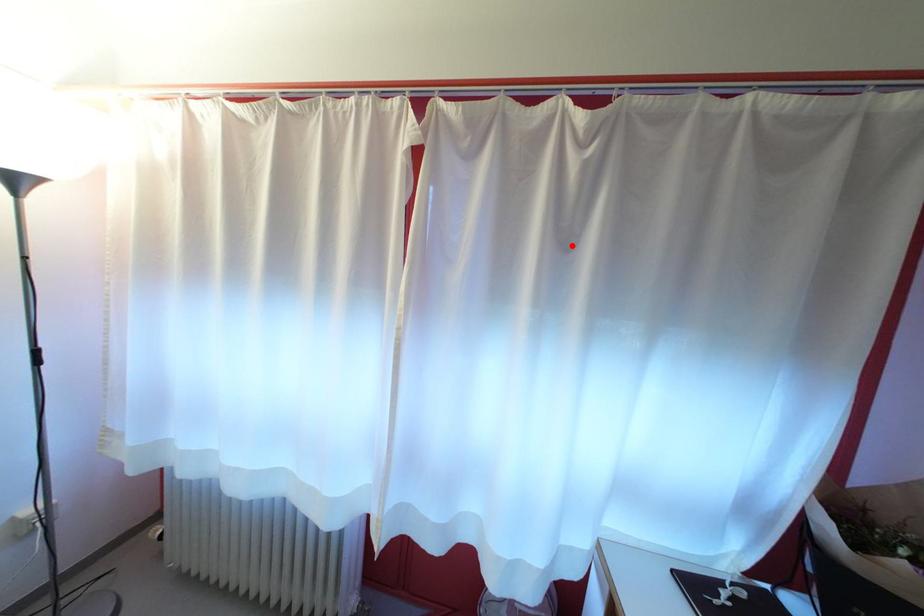
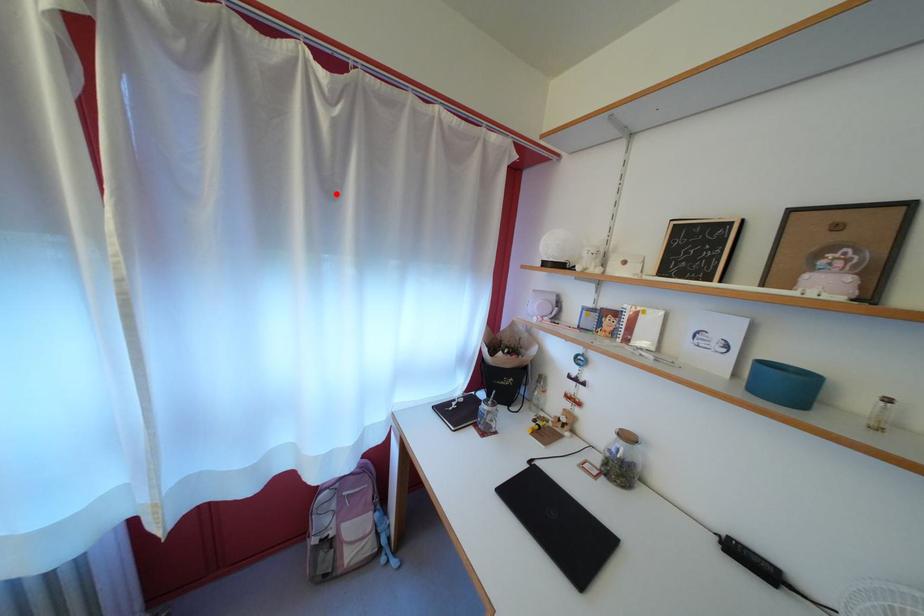
I am providing you with two images of the same scene from different viewpoints. A red point is marked on the first image and another point is marked on the second image. Do the highlighted points in image1 and image2 indicate the same real-world spot?

Yes